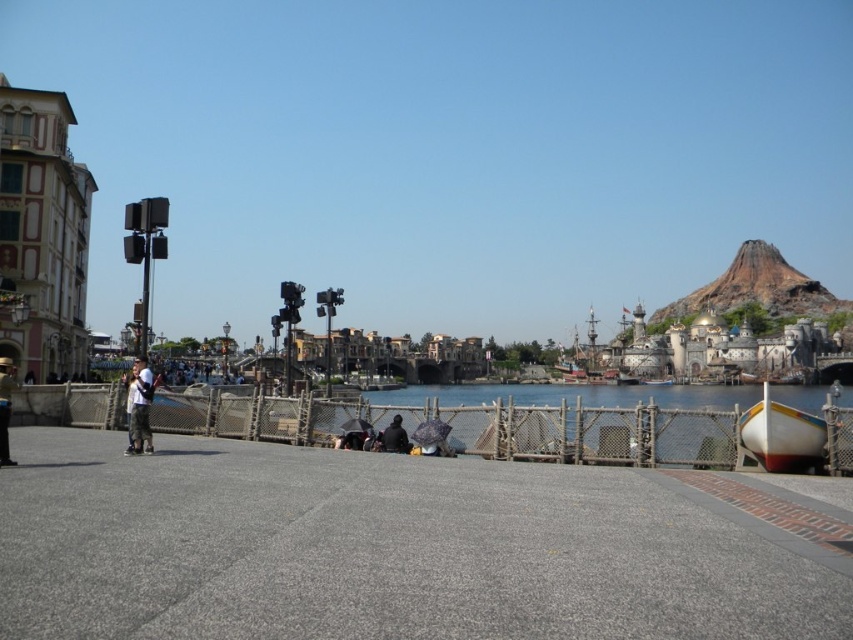
In the scene shown: You are a photographer trying to capture both the light blue jeans at center and the matte black jacket at lower left in a single frame. Given their sizes, which one should you zoom in on to ensure both fit comfortably in the shot?

Since the light blue jeans at center is wider than the matte black jacket at lower left, you should zoom out slightly to accommodate the wider light blue jeans at center while still keeping the matte black jacket at lower left in frame.

You are a photographer trying to capture both the light blue jeans at center and the matte black jacket at lower left in a single frame. Which object should you focus on first to ensure both are in the frame?

The light blue jeans at center is taller than the matte black jacket at lower left, so you should focus on the light blue jeans at center first to ensure both are in the frame.

You are standing at the center of the paved area and want to walk towards the white plastic boat at lower right. Which direction should you walk relative to the matte black jacket at lower left?

The white plastic boat at lower right is to the right of the matte black jacket at lower left, so you should walk towards the right relative to the matte black jacket at lower left.